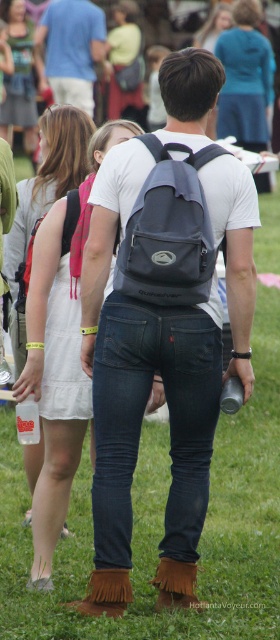
In the scene shown: You are a photographer trying to capture a candid shot of the two people in the scene. You need to ensure there is enough space between the matte black backpack at center and the dark blue denim jeans at center to avoid overlapping in the photo. The minimum required distance for your camera to focus without blur is 6 inches. Can you take the shot without them overlapping?

The matte black backpack at center and dark blue denim jeans at center are 6.59 inches apart from each other, which exceeds the minimum required distance of 6 inches. Therefore, you can take the shot without them overlapping.

You are planning to take a photo of both the blue denim jacket at upper center and the matte white dress at center. Since you want to capture both items clearly in the frame, which object should you focus on first to ensure proper focus, considering their sizes?

The blue denim jacket at upper center is wider than the matte white dress at center, so you should focus on the blue denim jacket at upper center first to ensure proper focus.